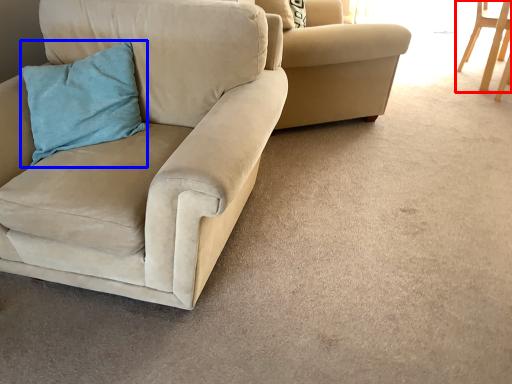
Question: Which of the following is the closest to the observer, chair (highlighted by a red box) or pillow (highlighted by a blue box)?

Choices:
 (A) chair
 (B) pillow

Answer: (B)